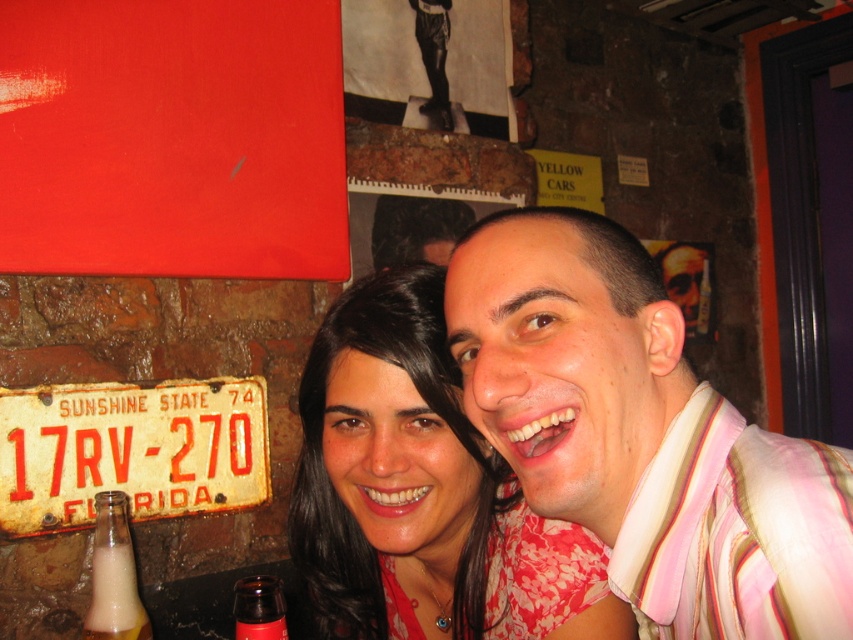
Is rusty metal license plate at lower left above translucent glass bottle at lower left?

Correct, rusty metal license plate at lower left is located above translucent glass bottle at lower left.

Is point (9, 532) positioned behind point (111, 545)?

Yes.

This screenshot has width=853, height=640. Find the location of `rusty metal license plate at lower left`. rusty metal license plate at lower left is located at coordinates (131, 451).

Is pink striped shirt at center thinner than rusty metal license plate at lower left?

Correct, pink striped shirt at center's width is less than rusty metal license plate at lower left's.

Find the location of a particular element. Image resolution: width=853 pixels, height=640 pixels. pink striped shirt at center is located at coordinates (642, 435).

Does point (451, 272) lie behind point (3, 408)?

That is False.

Where is `pink striped shirt at center`? The width and height of the screenshot is (853, 640). pink striped shirt at center is located at coordinates (642, 435).

Is the position of matte red hair at center more distant than that of rusty metal license plate at lower left?

No, matte red hair at center is closer to the viewer.

Who is shorter, matte red hair at center or rusty metal license plate at lower left?

With less height is rusty metal license plate at lower left.

Who is more distant from viewer, (329, 552) or (184, 449)?

Positioned behind is point (184, 449).

Where is `matte red hair at center`? The image size is (853, 640). matte red hair at center is located at coordinates (422, 490).